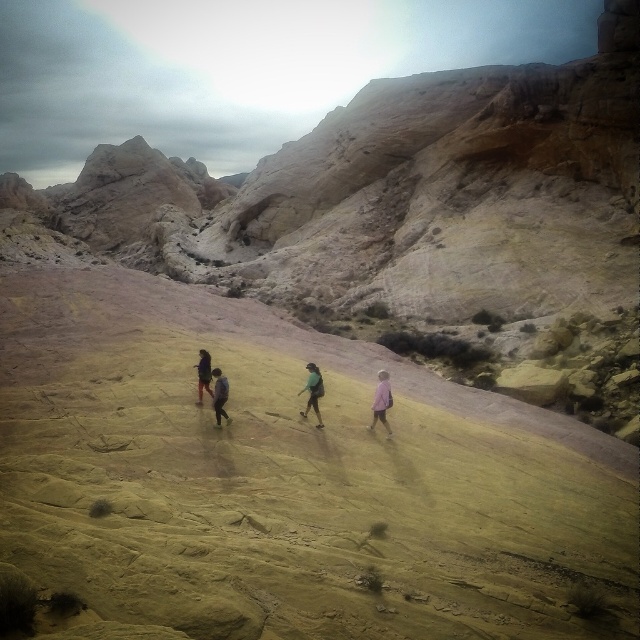
You are planning to take a photo of the pink fabric at center and dark gray fabric jacket at center. Which one should you focus on if you want to capture both in the same frame without moving the camera?

The pink fabric at center is located above the dark gray fabric jacket at center, so you should focus on the pink fabric at center to ensure both are in the same frame without moving the camera.

You are part of a hiking group and need to locate two items left behind on the sandstone terrain. You see a pink fabric at center and a green fabric jacket at center. Which item would you reach first while moving towards the center of the scene?

The pink fabric at center is closer to the viewer than the green fabric jacket at center, so you would reach the pink fabric at center first.

You are one of the hikers in the desert scene. You notice a pink fabric at center. Based on its coordinates, can you determine if it is positioned closer to the top or bottom of the image?

The pink fabric at center is located at point 0.628 on the vertical axis. Since coordinates typically range from 0 to 1, with 0 at the bottom and 1 at the top, a value of 0.628 places it closer to the bottom of the image.